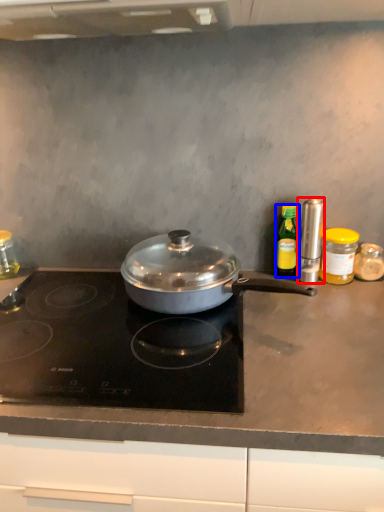
Question: Which object appears farthest to the camera in this image, kitchen appliance (highlighted by a red box) or kitchen appliance (highlighted by a blue box)?

Choices:
 (A) kitchen appliance
 (B) kitchen appliance

Answer: (B)